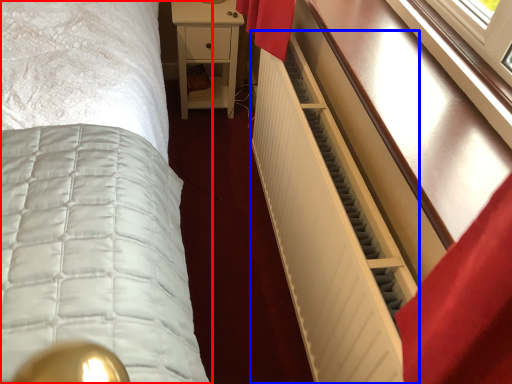
Question: Which point is further to the camera, bed (highlighted by a red box) or radiator (highlighted by a blue box)?

Choices:
 (A) bed
 (B) radiator

Answer: (A)